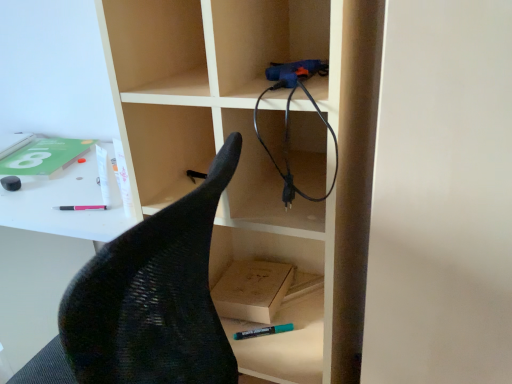
Question: Is light brown cardboard box at lower center far from black mesh chair at left?

Choices:
 (A) yes
 (B) no

Answer: (B)

Question: Is light brown cardboard box at lower center closer to camera compared to black mesh chair at left?

Choices:
 (A) yes
 (B) no

Answer: (B)

Question: Considering the relative sizes of light brown cardboard box at lower center and black mesh chair at left in the image provided, is light brown cardboard box at lower center shorter than black mesh chair at left?

Choices:
 (A) no
 (B) yes

Answer: (B)

Question: From a real-world perspective, is light brown cardboard box at lower center below black mesh chair at left?

Choices:
 (A) yes
 (B) no

Answer: (B)

Question: From the image's perspective, is light brown cardboard box at lower center on top of black mesh chair at left?

Choices:
 (A) yes
 (B) no

Answer: (A)

Question: From a real-world perspective, is teal matte marker at lower center, which is the first stationery in bottom-to-top order, positioned above or below black rubber cable at upper right?

Choices:
 (A) below
 (B) above

Answer: (A)

Question: In terms of height, does teal matte marker at lower center, the 2th stationery in the top-to-bottom sequence, look taller or shorter compared to black rubber cable at upper right?

Choices:
 (A) short
 (B) tall

Answer: (A)

Question: Is teal matte marker at lower center, which is the first stationery in bottom-to-top order, wider or thinner than black rubber cable at upper right?

Choices:
 (A) wide
 (B) thin

Answer: (B)

Question: Would you say teal matte marker at lower center, marked as the 1th stationery in a front-to-back arrangement, is inside or outside black rubber cable at upper right?

Choices:
 (A) inside
 (B) outside

Answer: (B)

Question: In terms of height, does wooden bookshelf at center look taller or shorter compared to black mesh chair at left?

Choices:
 (A) short
 (B) tall

Answer: (B)

Question: Is wooden bookshelf at center inside the boundaries of black mesh chair at left, or outside?

Choices:
 (A) outside
 (B) inside

Answer: (A)

Question: From a real-world perspective, is wooden bookshelf at center positioned above or below black mesh chair at left?

Choices:
 (A) below
 (B) above

Answer: (B)

Question: In terms of width, does wooden bookshelf at center look wider or thinner when compared to black mesh chair at left?

Choices:
 (A) wide
 (B) thin

Answer: (B)

Question: From the image's perspective, is wooden bookshelf at center positioned above or below matte black eraser at left, the first stationery in the top-to-bottom sequence?

Choices:
 (A) below
 (B) above

Answer: (A)

Question: Considering their positions, is wooden bookshelf at center located in front of or behind matte black eraser at left, which is the 1th stationery from back to front?

Choices:
 (A) front
 (B) behind

Answer: (A)